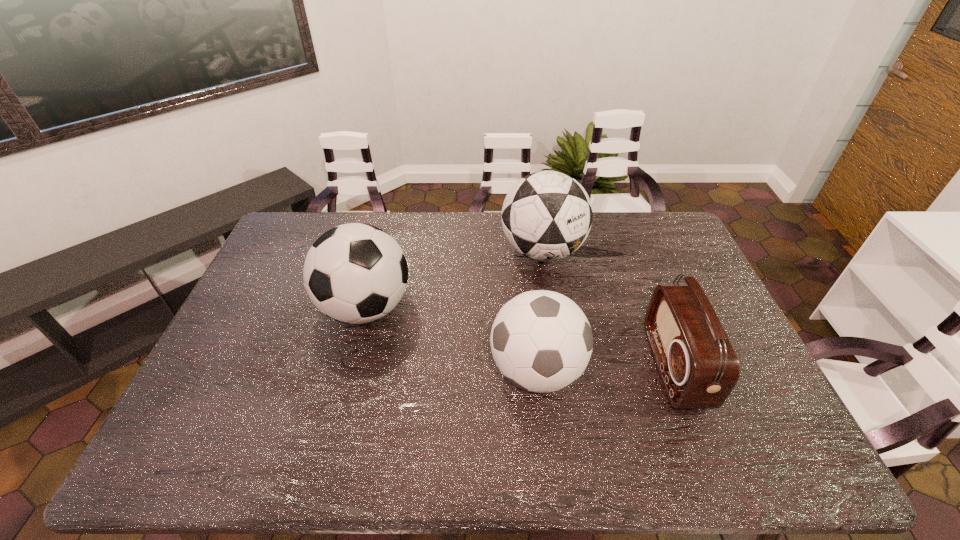
At what (x,y) coordinates should I click in order to perform the action: click on vacant region at the left edge of the desktop. Please return your answer as a coordinate pair (x, y). Looking at the image, I should click on (285, 268).

You are a GUI agent. You are given a task and a screenshot of the screen. Output one action in this format:
    pyautogui.click(x=<x>, y=<y>)
    Task: Click on the vacant space at the right edge of the desktop
    
    Given the screenshot: What is the action you would take?
    pyautogui.click(x=734, y=433)

At what (x,y) coordinates should I click in order to perform the action: click on free space at the far left corner. Please return your answer as a coordinate pair (x, y). This screenshot has width=960, height=540. Looking at the image, I should click on (306, 231).

This screenshot has width=960, height=540. I want to click on vacant point at the far right corner, so click(654, 232).

Identify which object is located as the second nearest to the rightmost object. Please provide its 2D coordinates. Your answer should be formatted as a tuple, i.e. [(x, y)], where the tuple contains the x and y coordinates of a point satisfying the conditions above.

[(547, 215)]

Where is `object that is the third nearest to the radio receiver`? The image size is (960, 540). object that is the third nearest to the radio receiver is located at coordinates (355, 273).

The image size is (960, 540). Identify the location of soccer ball object that ranks as the closest to the radio receiver. (541, 341).

Where is `soccer ball object that ranks as the third closest to the radio receiver`? The height and width of the screenshot is (540, 960). soccer ball object that ranks as the third closest to the radio receiver is located at coordinates (355, 273).